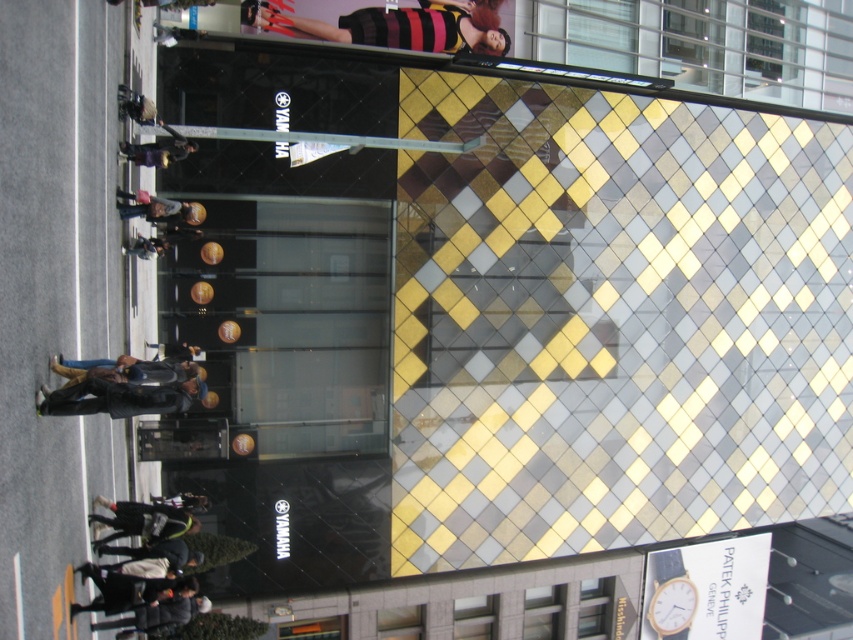
You are standing at the point with coordinates (117,397) in the image. What object is located at this point?

The dark blue leather jacket at center is located at the point with coordinates (117,397).

You are a photographer standing in front of the Yamaha building. You notice two jackets hanging on a rack to the left of the entrance. The dark gray jacket at lower left and the dark brown leather jacket at upper left. Which jacket is higher up?

The dark brown leather jacket at upper left is higher up than the dark gray jacket at lower left.

In the scene shown: You are standing in front of the Yamaha building and see two jackets. The dark blue leather jacket at center and the dark gray jacket at lower left. Which jacket is positioned to the right of the other?

The dark blue leather jacket at center is positioned to the right of the dark gray jacket at lower left.